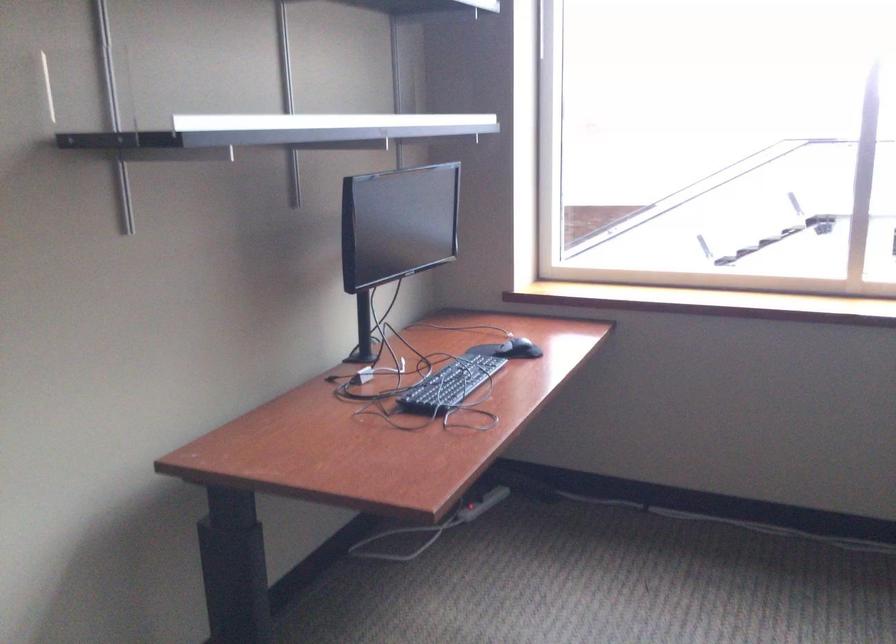
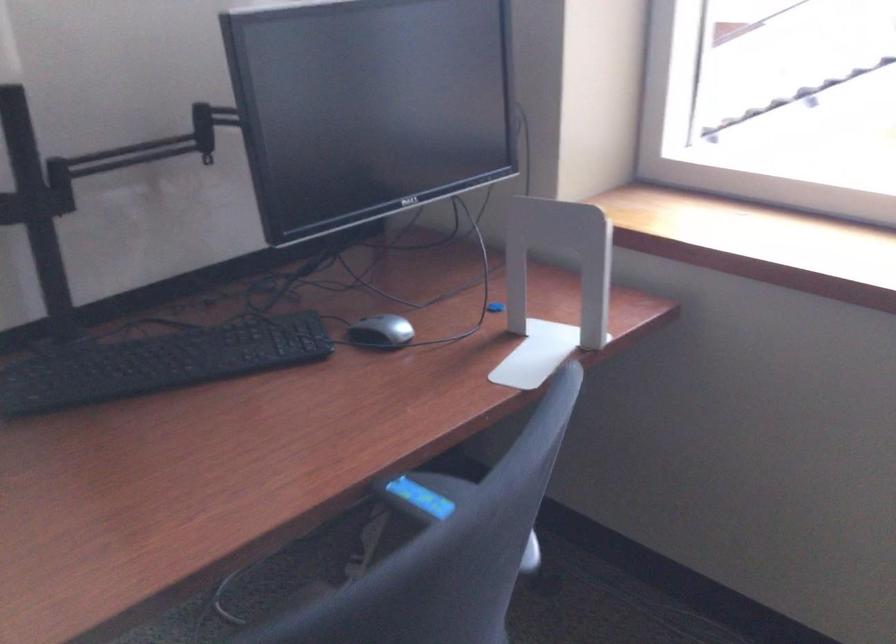
Question: Which direction would the cameraman need to move to produce the second image? Reply with the corresponding letter.

Choices:
 (A) Left
 (B) Right
 (C) Forward
 (D) Backward

Answer: (B)